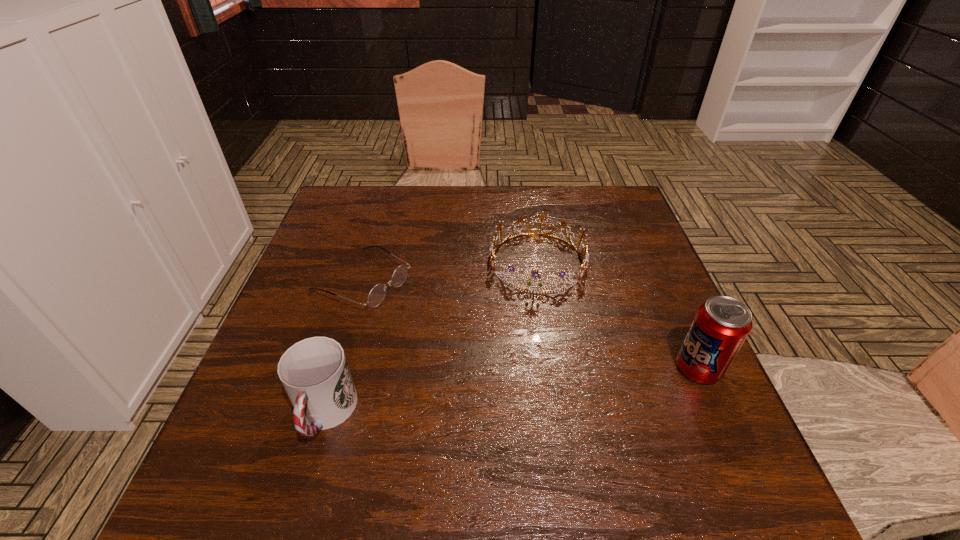
Find the location of `cup`. cup is located at coordinates 314,372.

Identify the location of the rightmost object. This screenshot has height=540, width=960. (721, 325).

At what (x,y) coordinates should I click in order to perform the action: click on soda can. Please return your answer as a coordinate pair (x, y). Looking at the image, I should click on (721, 325).

This screenshot has height=540, width=960. In order to click on the third object from left to right in this screenshot , I will do `click(492, 251)`.

You are a GUI agent. You are given a task and a screenshot of the screen. Output one action in this format:
    pyautogui.click(x=<x>, y=<y>)
    Task: Click on the second shortest object
    
    Given the screenshot: What is the action you would take?
    tap(492, 251)

Find the location of a particular element. the shortest object is located at coordinates (378, 292).

Locate an element on the screen. Image resolution: width=960 pixels, height=540 pixels. free space located 0.050m on the left of the soda can is located at coordinates (652, 369).

At what (x,y) coordinates should I click in order to perform the action: click on vacant space located 0.070m on the front-facing side of the third tallest object. Please return your answer as a coordinate pair (x, y). Looking at the image, I should click on (532, 319).

Locate an element on the screen. This screenshot has height=540, width=960. free point located 0.170m on the front-facing side of the third tallest object is located at coordinates (528, 353).

Locate an element on the screen. vacant point located 0.290m on the front-facing side of the third tallest object is located at coordinates (523, 402).